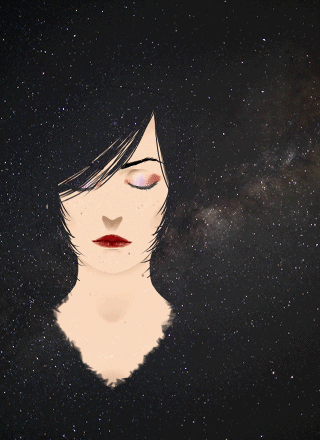
Where is `chest`? The image size is (320, 440). chest is located at coordinates tap(119, 366).